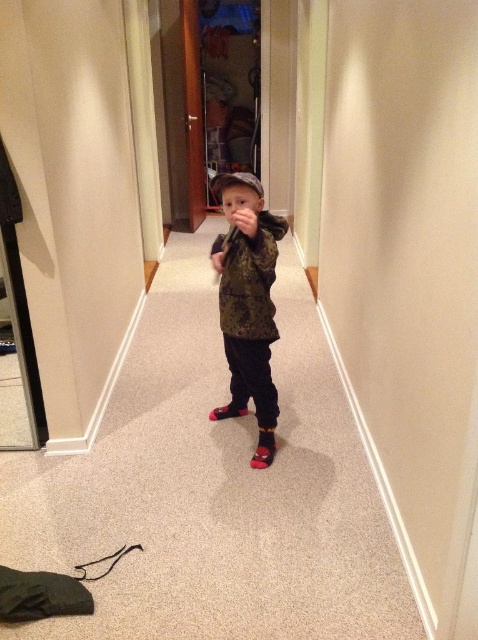
In the scene shown: You are a photographer trying to capture a clear shot of the camouflage jacket at center and the red suede shoe at center. Since both are at the center, which one will appear larger in the photo?

The camouflage jacket at center is closer to the viewer than the red suede shoe at center, so it will appear larger in the photo.

You are a parent trying to put shoes on your child. You have two options in front of you in the hallway. The red suede shoe at center and the red fabric shoe at center. Which one is bigger?

The red suede shoe at center is larger in size than the red fabric shoe at center, so the red suede shoe at center is bigger.